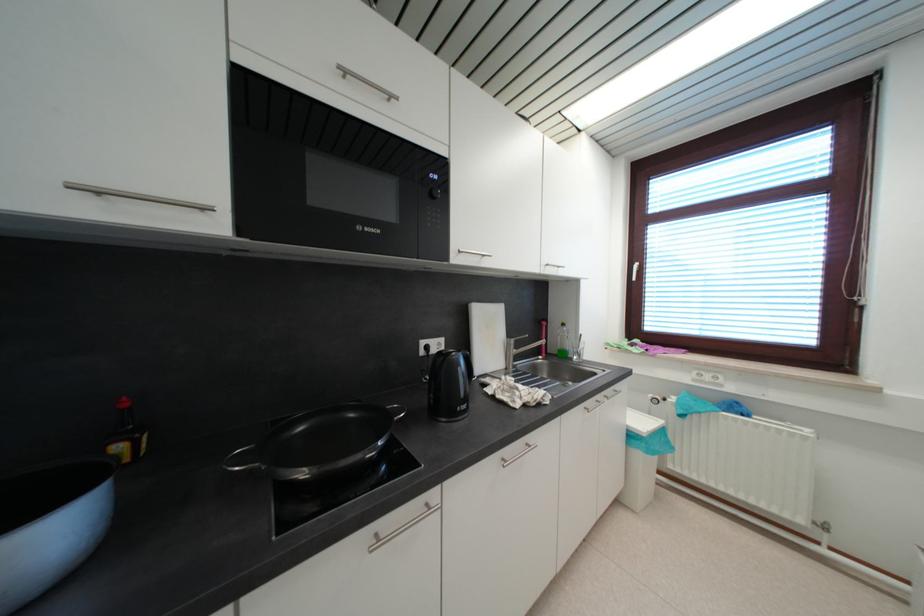
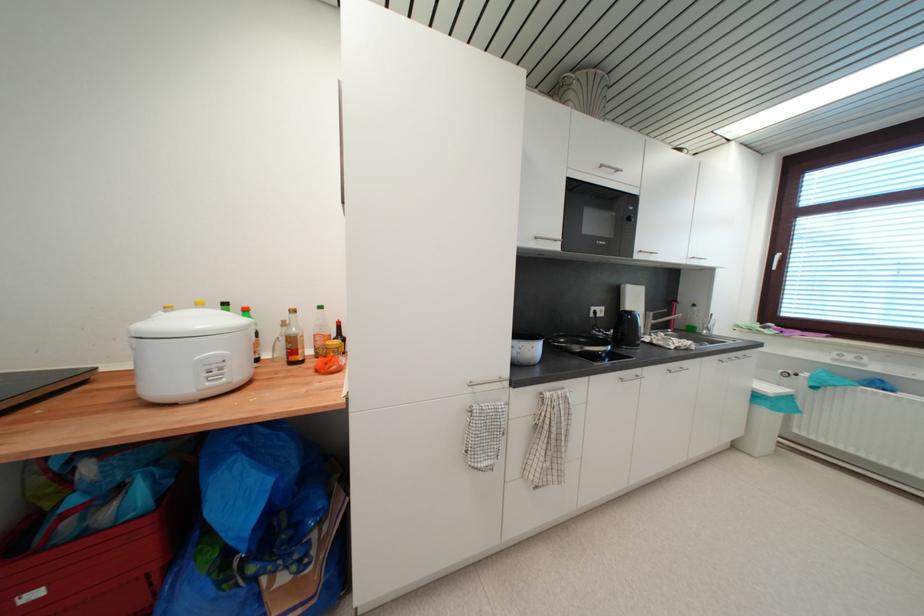
The point at (x=382, y=538) is marked in the first image. Where is the corresponding point in the second image?

(626, 381)